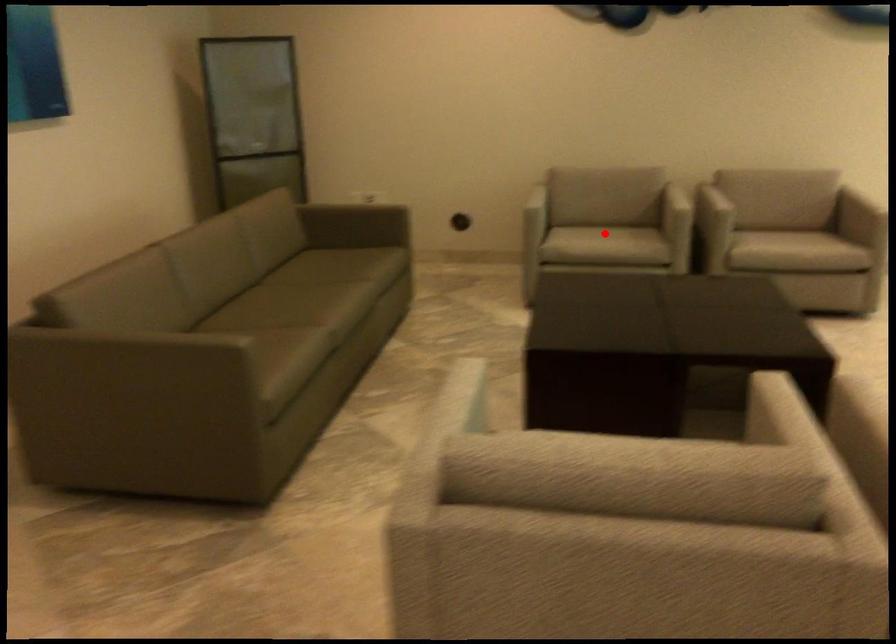
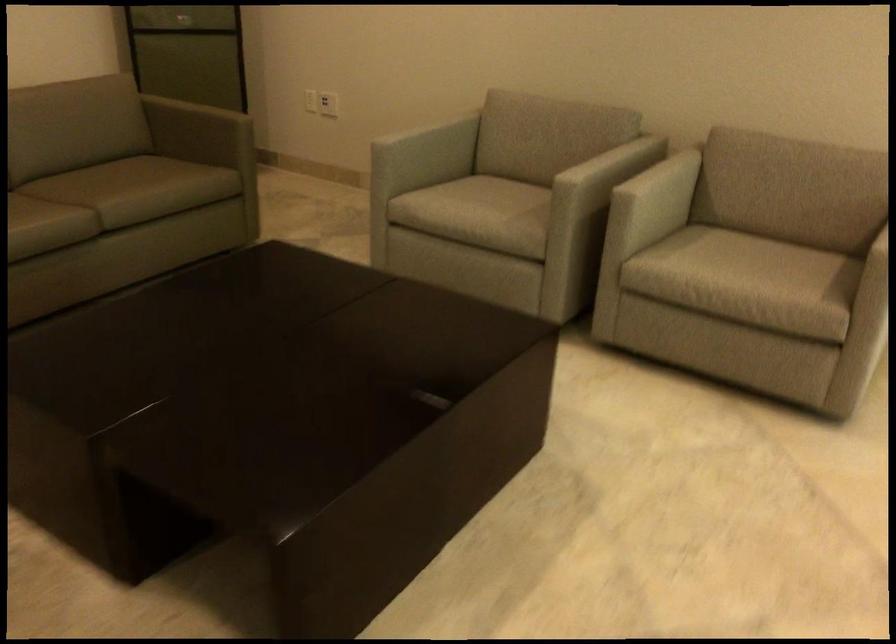
The point at the highlighted location is marked in the first image. Where is the corresponding point in the second image?

(480, 207)